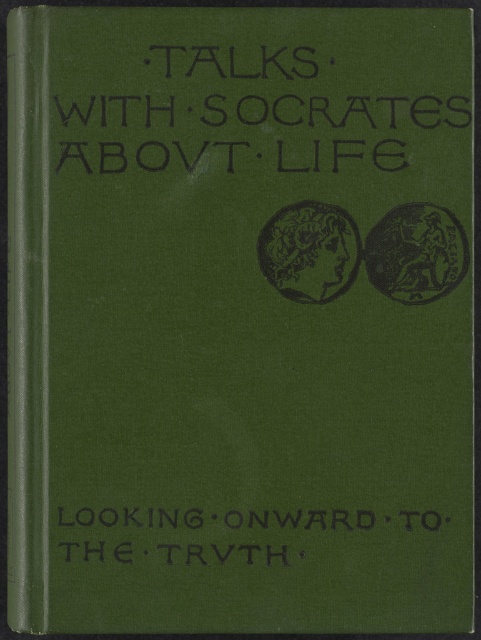
You are a book designer who wants to ensure the black textured text at upper center on the book cover is visible to readers standing 28 inches away. Based on the provided information, will the text be clearly visible at that distance?

The black textured text at upper center is 28.16 inches away from viewer, so it will be clearly visible to readers standing 28 inches away as the distance is almost the same.

You are examining the book cover and notice two points marked on it. The first point is at coordinates point (113, 129) and the second is at point (323, 516). Which of these two points appears closer to you on the book cover?

Point (113, 129) is closer to the camera than point (323, 516), so the first point appears closer to you on the book cover.

What is the relationship between the sizes of the black textured text at upper center and the black textured text at bottom on the book cover?

The black textured text at upper center is larger in size than the black textured text at bottom.